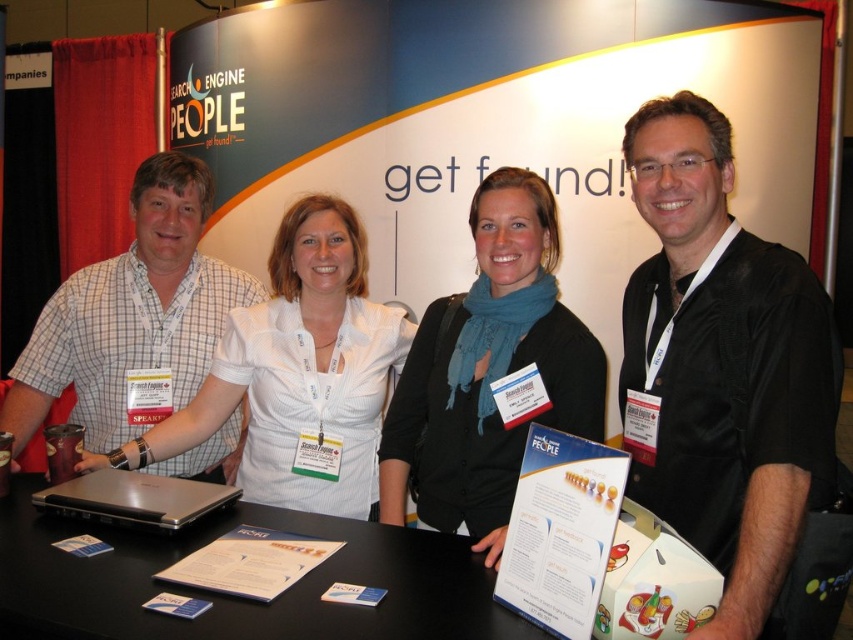
Question: Is white checkered shirt at left in front of silver metallic laptop at lower left?

Choices:
 (A) yes
 (B) no

Answer: (B)

Question: Among these objects, which one is farthest from the camera?

Choices:
 (A) black matte scarf at center
 (B) black glossy table at center
 (C) white checkered shirt at left

Answer: (C)

Question: Does black satin shirt at center have a smaller size compared to silver metallic laptop at lower left?

Choices:
 (A) yes
 (B) no

Answer: (B)

Question: Among these points, which one is nearest to the camera?

Choices:
 (A) (753, 253)
 (B) (585, 388)
 (C) (158, 524)

Answer: (A)

Question: Which of the following is the closest to the observer?

Choices:
 (A) (256, 515)
 (B) (492, 200)
 (C) (160, 497)
 (D) (840, 516)

Answer: (D)

Question: Does white checkered shirt at left come in front of silver metallic laptop at lower left?

Choices:
 (A) yes
 (B) no

Answer: (B)